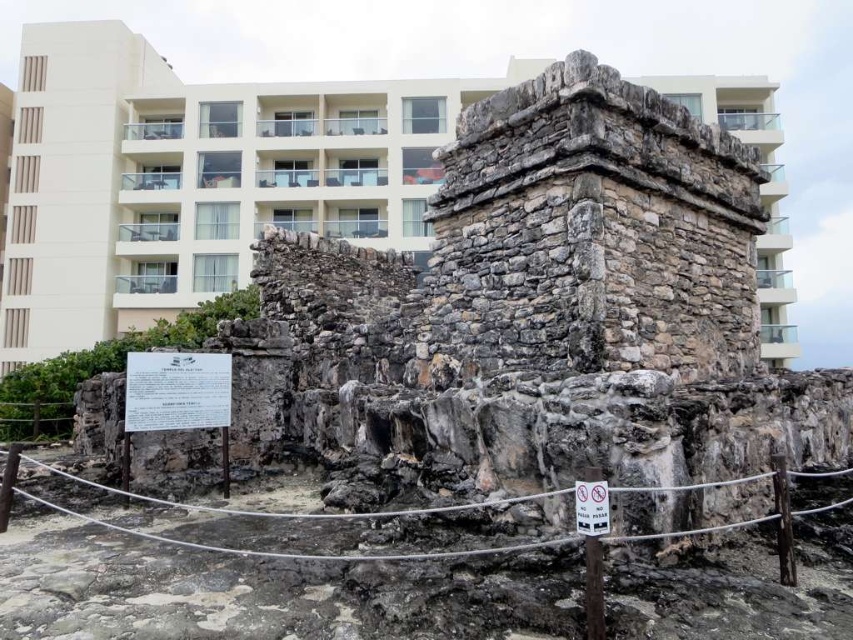
In the scene shown: You are standing in front of an ancient stone structure and a modern building. You have a drone that can fly up to 50 meters. Can your drone reach the point marked at coordinates point (35, 134)?

The point marked at coordinates point (35, 134) is 44.54 meters away from the viewer. Since the drone can fly up to 50 meters, it can reach the point.

You are a tourist standing in front of the ancient stone structure and want to read both the white paper sign at center and the white plastic sign at center. Which sign should you look at first to read the one closer to you?

The white paper sign at center is closer to you than the white plastic sign at center, so you should look at the white paper sign at center first.

You are standing in front of the ancient stone structure and want to take a photo that includes both the ancient structure and the modern building. The camera can only focus on objects within a certain depth range. If you focus on the point at point (711,100), will the point at point (173,406) also be in focus?

Point (711,100) is further to the camera than point (173,406). Since focusing on a distant object may not keep a closer object in focus, the point at (173,406) might not be in focus if the camera depth of field is limited.